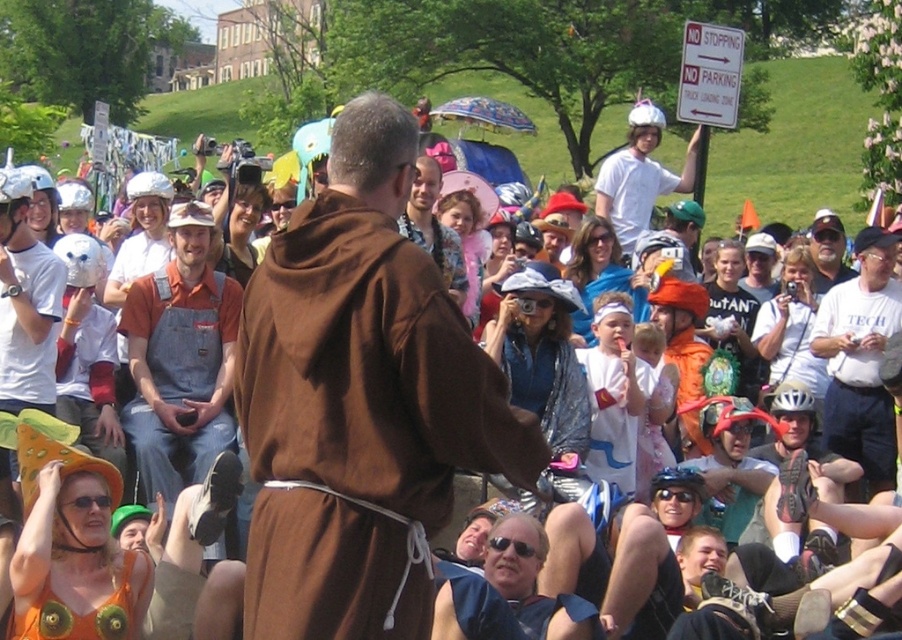
You are a photographer at this festival trying to capture the monk in the brown robe at center. You need to position yourself so that your camera is directly in line with the brown cloth at center. What coordinate should you aim for?

The brown cloth at center is located at point (360, 403), so you should aim your camera at those coordinates to capture the monk in the brown robe at center.

You are a photographer at the event and want to capture a photo that includes both the brown cloth at center and the white matte helmet at upper center. Which object should you focus on first to ensure both are in frame?

The brown cloth at center is positioned under the white matte helmet at upper center, so you should focus on the white matte helmet at upper center first to ensure both are in frame.

You are organizing a costume parade and need to arrange participants by size. You have two participants wearing denim overalls at center and white cotton shirt at center. Which participant should be placed first if you want to arrange them from largest to smallest?

The denim overalls at center should be placed first because it has a larger size compared to the white cotton shirt at center.